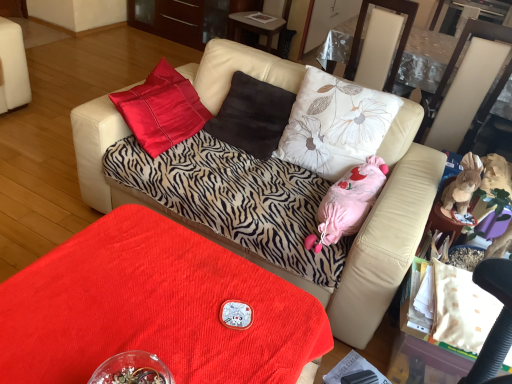
Question: Considering the positions of pink fabric stuffed toy at center, the first animal positioned from the left, and zebra-patterned fabric couch at center in the image, is pink fabric stuffed toy at center, the first animal positioned from the left, bigger or smaller than zebra-patterned fabric couch at center?

Choices:
 (A) big
 (B) small

Answer: (B)

Question: Relative to zebra-patterned fabric couch at center, is pink fabric stuffed toy at center, the first animal positioned from the left, in front or behind?

Choices:
 (A) front
 (B) behind

Answer: (B)

Question: Estimate the real-world distances between objects in this image. Which object is farther from the beige leather swivel chair at right?

Choices:
 (A) velvet red table at lower center
 (B) pink fabric stuffed toy at center, the first animal positioned from the left
 (C) brown suede pillow at center, positioned as the first pillow in left-to-right order
 (D) glossy wood dresser at upper center
 (E) transparent plastic glass table at upper right

Answer: (D)

Question: Which is farther from the transparent plastic glass table at upper right?

Choices:
 (A) brown plush toy at right, which ranks as the second animal in left-to-right order
 (B) floral fabric pillow at center, which is the 1th pillow in right-to-left order
 (C) beige leather swivel chair at right
 (D) velvet red table at lower center
 (E) zebra-patterned fabric couch at center

Answer: (D)